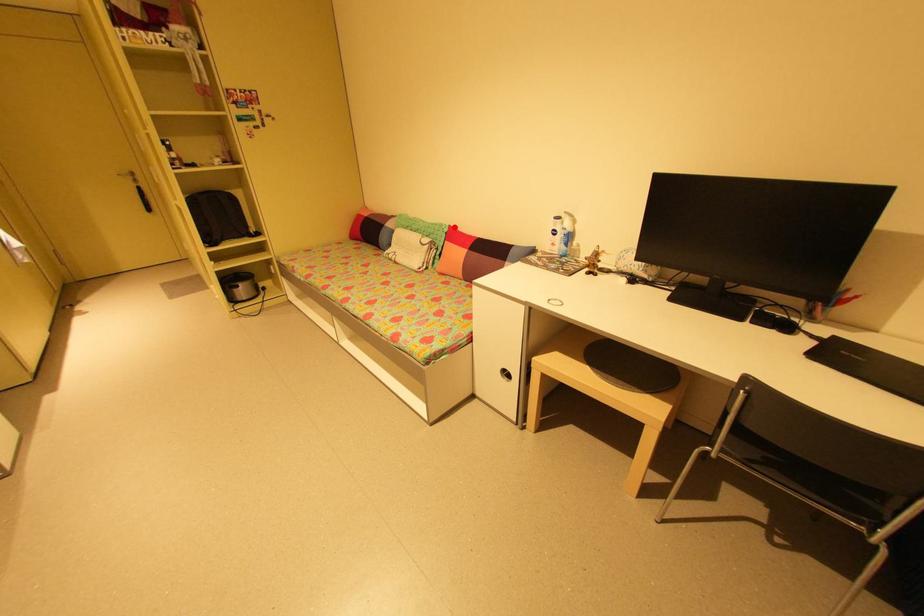
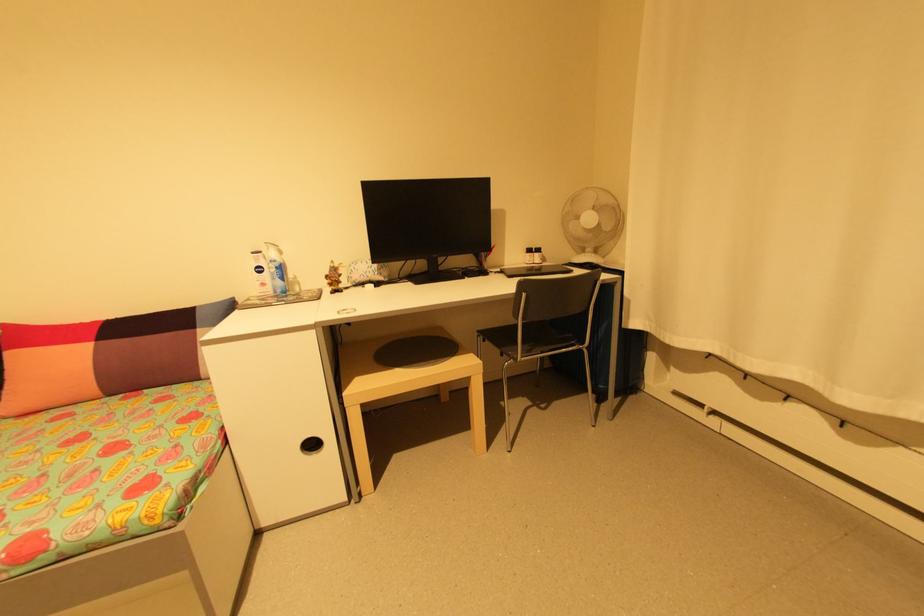
Question: I am providing you with two images of the same scene from different viewpoints. In image1, a red point is highlighted. Considering the same 3D point in image2, which of the following is correct?

Choices:
 (A) It is closer
 (B) It is farther

Answer: (B)